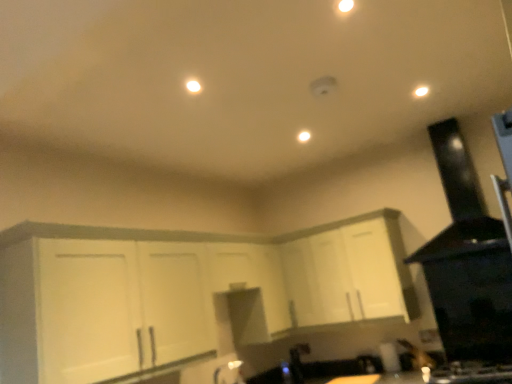
Question: Is white glossy light at upper right, which appears as the first light when viewed from the front, next to black matte exhaust hood at upper right?

Choices:
 (A) yes
 (B) no

Answer: (B)

Question: Considering the relative sizes of white glossy light at upper right, marked as the second light in a bottom-to-top arrangement, and black matte exhaust hood at upper right in the image provided, is white glossy light at upper right, marked as the second light in a bottom-to-top arrangement, bigger than black matte exhaust hood at upper right?

Choices:
 (A) no
 (B) yes

Answer: (A)

Question: Is white glossy light at upper right, acting as the 2th light starting from the left, aimed at black matte exhaust hood at upper right?

Choices:
 (A) no
 (B) yes

Answer: (A)

Question: Does white glossy light at upper right, placed as the second light when sorted from back to front, appear on the left side of black matte exhaust hood at upper right?

Choices:
 (A) yes
 (B) no

Answer: (A)

Question: Is white glossy light at upper right, which appears as the first light when viewed from the front, thinner than black matte exhaust hood at upper right?

Choices:
 (A) yes
 (B) no

Answer: (A)

Question: Is white glossy light at upper right, marked as the second light in a bottom-to-top arrangement, positioned beyond the bounds of black matte exhaust hood at upper right?

Choices:
 (A) no
 (B) yes

Answer: (B)

Question: From the image's perspective, is white matte cabinet at center, acting as the first cabinetry starting from the left, above white glossy faucet at lower center?

Choices:
 (A) yes
 (B) no

Answer: (A)

Question: Is the depth of white matte cabinet at center, acting as the first cabinetry starting from the left, greater than that of white glossy faucet at lower center?

Choices:
 (A) yes
 (B) no

Answer: (B)

Question: Is white matte cabinet at center, the 2th cabinetry viewed from the right, to the right of white glossy faucet at lower center from the viewer's perspective?

Choices:
 (A) yes
 (B) no

Answer: (B)

Question: Are white matte cabinet at center, acting as the first cabinetry starting from the left, and white glossy faucet at lower center beside each other?

Choices:
 (A) yes
 (B) no

Answer: (B)

Question: From a real-world perspective, is white matte cabinet at center, acting as the first cabinetry starting from the left, located higher than white glossy faucet at lower center?

Choices:
 (A) yes
 (B) no

Answer: (A)

Question: Is white matte cabinet at center, acting as the first cabinetry starting from the left, at the left side of white glossy faucet at lower center?

Choices:
 (A) no
 (B) yes

Answer: (B)

Question: Considering the relative sizes of black matte exhaust hood at upper right and white matte cabinet at center, acting as the first cabinetry starting from the left, in the image provided, is black matte exhaust hood at upper right smaller than white matte cabinet at center, acting as the first cabinetry starting from the left,?

Choices:
 (A) no
 (B) yes

Answer: (B)